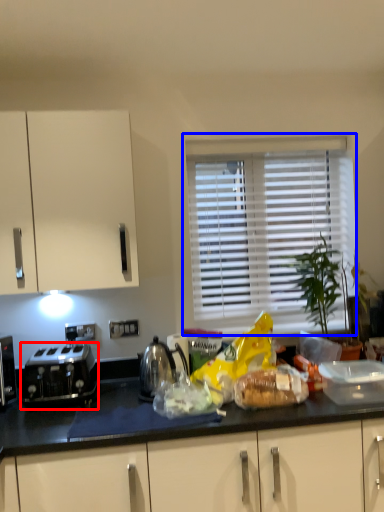
Question: Which of the following is the farthest to the observer, toaster (highlighted by a red box) or window (highlighted by a blue box)?

Choices:
 (A) toaster
 (B) window

Answer: (B)